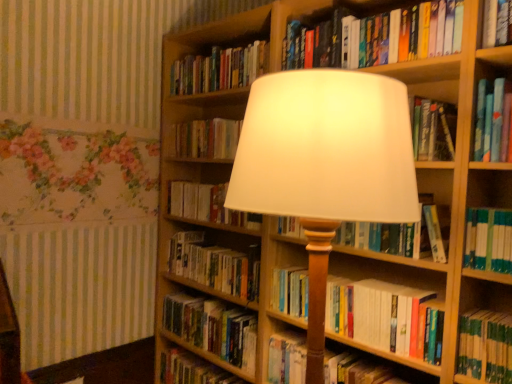
Question: Is hardcover book at center, arranged as the ninth book when viewed from the top, surrounding hardcover book at upper center, the tenth book ordered from the bottom?

Choices:
 (A) yes
 (B) no

Answer: (B)

Question: Does hardcover book at center, positioned as the second book in bottom-to-top order, have a greater height compared to hardcover book at upper center, which is the first book in top-to-bottom order?

Choices:
 (A) no
 (B) yes

Answer: (A)

Question: Does hardcover book at center, arranged as the ninth book when viewed from the top, have a lesser width compared to hardcover book at upper center, which is the first book in top-to-bottom order?

Choices:
 (A) yes
 (B) no

Answer: (B)

Question: Is hardcover book at center, arranged as the ninth book when viewed from the top, shorter than hardcover book at upper center, which is the first book in top-to-bottom order?

Choices:
 (A) no
 (B) yes

Answer: (B)

Question: Is hardcover book at center, positioned as the second book in bottom-to-top order, closer to camera compared to hardcover book at upper center, which is the first book in top-to-bottom order?

Choices:
 (A) yes
 (B) no

Answer: (A)

Question: Is hardcover book at lower center, acting as the 1th book starting from the bottom, taller or shorter than hardcover book at center, arranged as the ninth book when viewed from the top?

Choices:
 (A) tall
 (B) short

Answer: (A)

Question: From a real-world perspective, relative to hardcover book at center, arranged as the ninth book when viewed from the top, is hardcover book at lower center, the 10th book when ordered from top to bottom, vertically above or below?

Choices:
 (A) above
 (B) below

Answer: (B)

Question: Is hardcover book at lower center, the 10th book when ordered from top to bottom, inside the boundaries of hardcover book at center, arranged as the ninth book when viewed from the top, or outside?

Choices:
 (A) inside
 (B) outside

Answer: (B)

Question: Considering the positions of hardcover book at lower center, acting as the 1th book starting from the bottom, and hardcover book at center, arranged as the ninth book when viewed from the top, in the image, is hardcover book at lower center, acting as the 1th book starting from the bottom, bigger or smaller than hardcover book at center, arranged as the ninth book when viewed from the top,?

Choices:
 (A) big
 (B) small

Answer: (A)

Question: Is hardcover book at lower center, acting as the 1th book starting from the bottom, taller or shorter than white paper book at center, the 5th book positioned from the top?

Choices:
 (A) tall
 (B) short

Answer: (A)

Question: From the image's perspective, is hardcover book at lower center, the 10th book when ordered from top to bottom, located above or below white paper book at center, positioned as the 6th book in bottom-to-top order?

Choices:
 (A) below
 (B) above

Answer: (A)

Question: Considering their positions, is hardcover book at lower center, the 10th book when ordered from top to bottom, located in front of or behind white paper book at center, the 5th book positioned from the top?

Choices:
 (A) front
 (B) behind

Answer: (B)

Question: From a real-world perspective, is hardcover book at lower center, acting as the 1th book starting from the bottom, physically located above or below white paper book at center, positioned as the 6th book in bottom-to-top order?

Choices:
 (A) below
 (B) above

Answer: (A)

Question: Based on their sizes in the image, would you say hardcover book at lower center, the 10th book when ordered from top to bottom, is bigger or smaller than hardcover book at center, which is counted as the eighth book, starting from the bottom?

Choices:
 (A) big
 (B) small

Answer: (A)

Question: Would you say hardcover book at lower center, acting as the 1th book starting from the bottom, is to the left or to the right of hardcover book at center, which is counted as the eighth book, starting from the bottom, in the picture?

Choices:
 (A) right
 (B) left

Answer: (B)